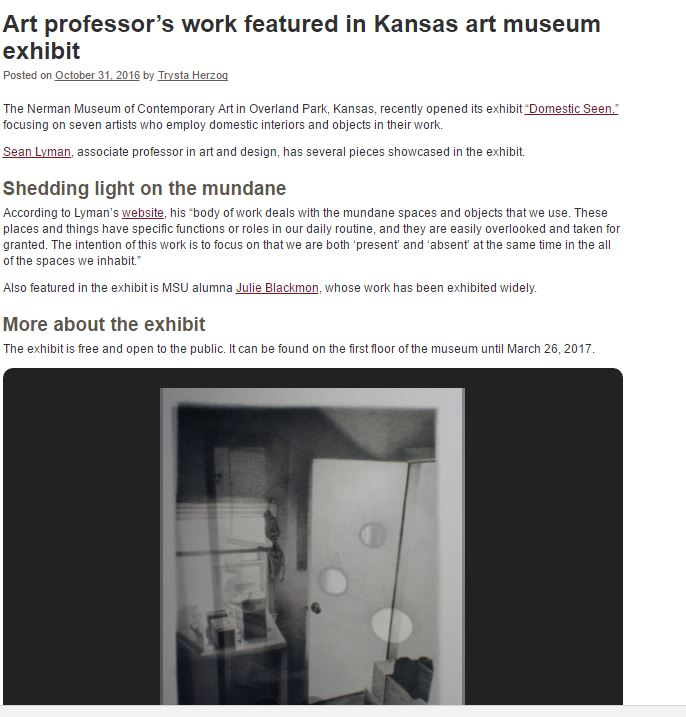
Locate an element on the screen. This screenshot has height=717, width=686. white border around photo is located at coordinates (444, 523), (422, 393), (172, 518).